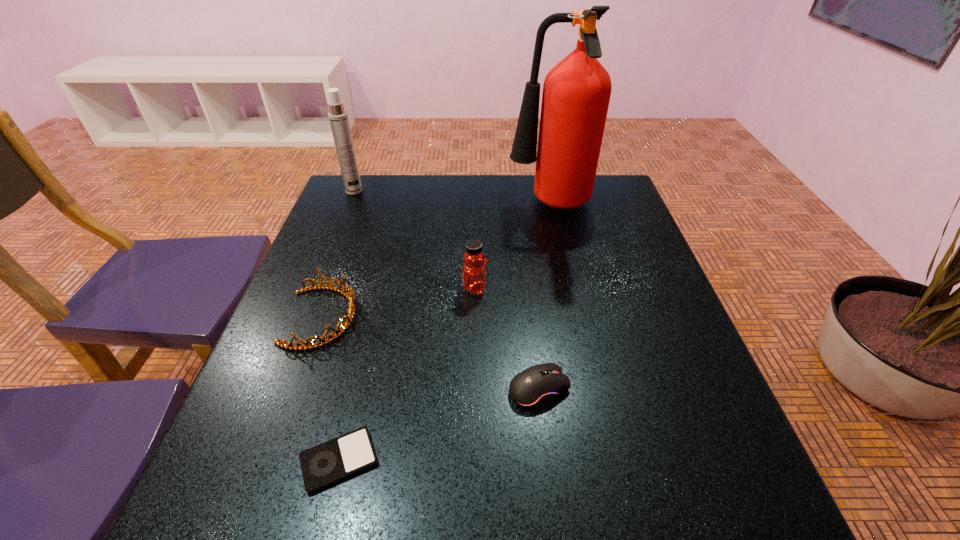
Where is `free point located at the nozzle of the fire extinguisher`? free point located at the nozzle of the fire extinguisher is located at coordinates (397, 206).

Locate an element on the screen. The height and width of the screenshot is (540, 960). free location located at the nozzle of the fire extinguisher is located at coordinates (484, 206).

Image resolution: width=960 pixels, height=540 pixels. Identify the location of vacant space situated on the front of the aerosol can. (327, 256).

Find the location of `vacant space located 0.220m on the front label of the honey`. vacant space located 0.220m on the front label of the honey is located at coordinates (582, 288).

Where is `free location located on the front-facing side of the tiara`? The height and width of the screenshot is (540, 960). free location located on the front-facing side of the tiara is located at coordinates (396, 318).

Locate an element on the screen. This screenshot has width=960, height=540. free point located 0.340m on the back of the fifth farthest object is located at coordinates (524, 257).

Find the location of `vacant space located on the right of the shortest object`. vacant space located on the right of the shortest object is located at coordinates (410, 460).

Image resolution: width=960 pixels, height=540 pixels. I want to click on fire extinguisher located at the far edge, so click(576, 93).

This screenshot has height=540, width=960. In order to click on aerosol can at the far edge in this screenshot , I will do `click(338, 117)`.

The image size is (960, 540). In order to click on object that is positioned at the near edge in this screenshot , I will do `click(332, 461)`.